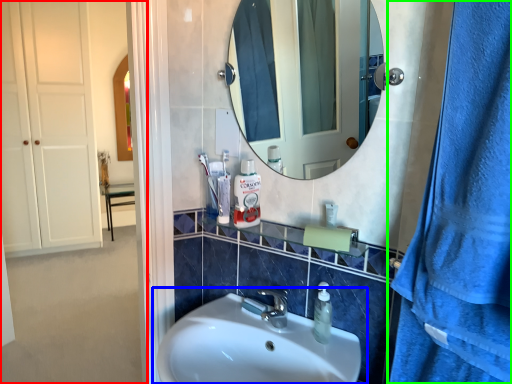
Question: Considering the real-world distances, which object is closest to side (highlighted by a red box)? sink (highlighted by a blue box) or shower curtain (highlighted by a green box).

Choices:
 (A) sink
 (B) shower curtain

Answer: (A)